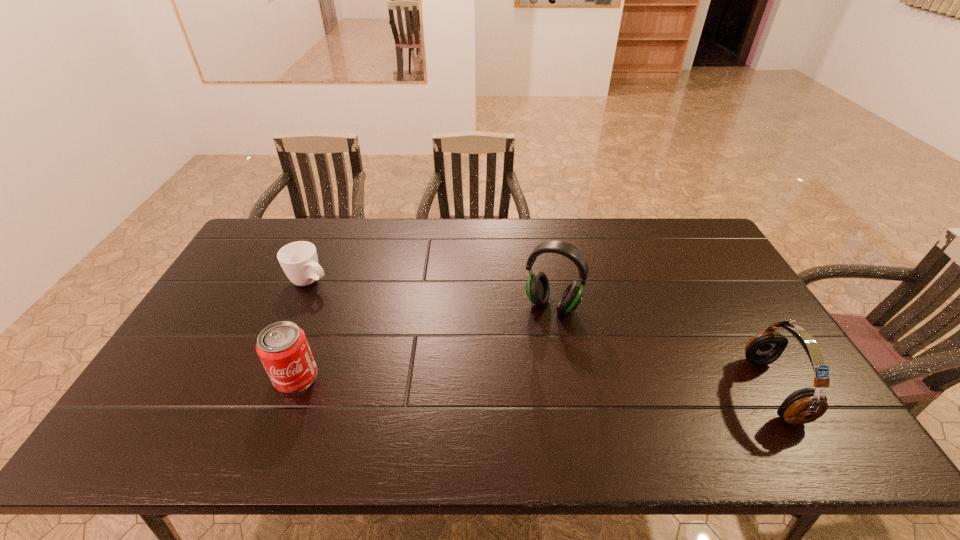
This screenshot has width=960, height=540. Identify the location of free area in between the shortest object and the shorter headset. (541, 335).

You are a GUI agent. You are given a task and a screenshot of the screen. Output one action in this format:
    pyautogui.click(x=<x>, y=<y>)
    Task: Click on the object that is the second closest to the second shortest object
    
    Given the screenshot: What is the action you would take?
    pyautogui.click(x=537, y=288)

Locate which object ranks in proximity to the rightmost object. Please provide its 2D coordinates. Your answer should be formatted as a tuple, i.e. [(x, y)], where the tuple contains the x and y coordinates of a point satisfying the conditions above.

[(537, 288)]

Where is `vacant space that satisfies the following two spatial constraints: 1. on the front side of the third object from left to right; 2. on the ear cups of the right headset`? The image size is (960, 540). vacant space that satisfies the following two spatial constraints: 1. on the front side of the third object from left to right; 2. on the ear cups of the right headset is located at coordinates (566, 390).

The height and width of the screenshot is (540, 960). What are the coordinates of `vacant space that satisfies the following two spatial constraints: 1. on the front side of the farther headset; 2. on the right side of the shortest object` in the screenshot? It's located at (300, 305).